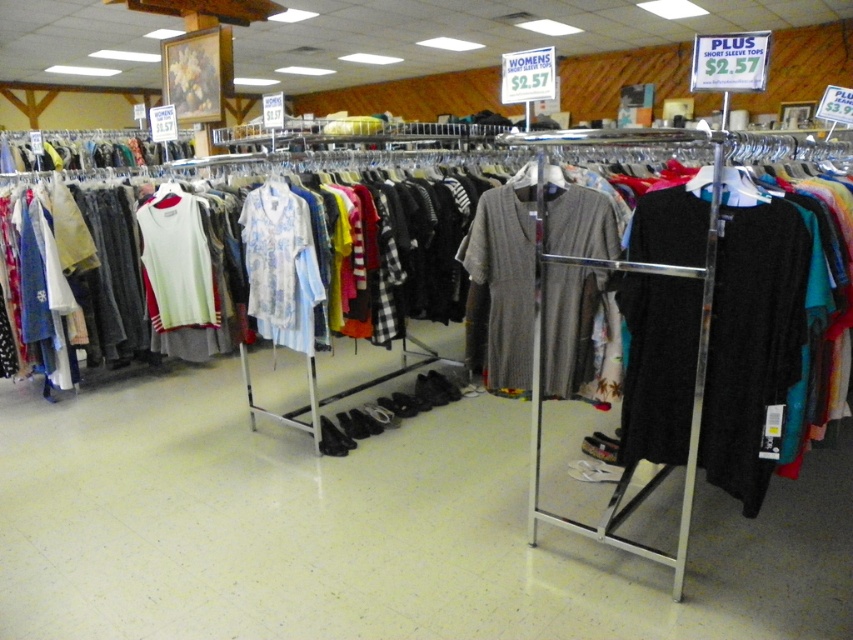
Is knit gray dress at center positioned behind light blue floral fabric shirt at center?

No, it is in front of light blue floral fabric shirt at center.

Between knit gray dress at center and light blue floral fabric shirt at center, which one has more height?

light blue floral fabric shirt at center

Between point (569, 348) and point (283, 324), which one is positioned in front?

Point (569, 348)

Where is `knit gray dress at center`? Image resolution: width=853 pixels, height=640 pixels. knit gray dress at center is located at coordinates (502, 288).